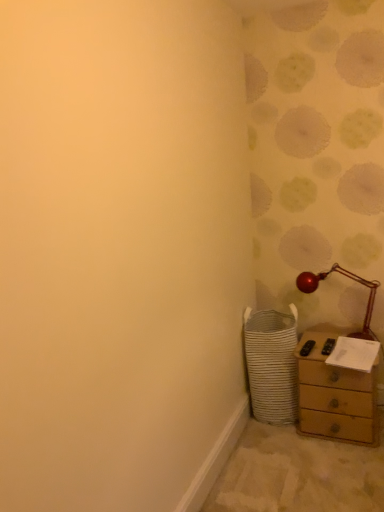
Question: From a real-world perspective, is white woven laundry basket at lower right located higher than wooden chest of drawers at lower right?

Choices:
 (A) yes
 (B) no

Answer: (A)

Question: Is white woven laundry basket at lower right closer to the viewer compared to wooden chest of drawers at lower right?

Choices:
 (A) no
 (B) yes

Answer: (A)

Question: Can we say white woven laundry basket at lower right lies outside wooden chest of drawers at lower right?

Choices:
 (A) no
 (B) yes

Answer: (B)

Question: Is wooden chest of drawers at lower right surrounded by white woven laundry basket at lower right?

Choices:
 (A) no
 (B) yes

Answer: (A)

Question: Considering the relative sizes of white woven laundry basket at lower right and wooden chest of drawers at lower right in the image provided, is white woven laundry basket at lower right wider than wooden chest of drawers at lower right?

Choices:
 (A) no
 (B) yes

Answer: (B)

Question: Does point (299, 342) appear closer or farther from the camera than point (281, 420)?

Choices:
 (A) farther
 (B) closer

Answer: (B)

Question: Would you say wooden chest of drawers at lower right is inside or outside white woven laundry basket at lower right?

Choices:
 (A) inside
 (B) outside

Answer: (B)

Question: Is wooden chest of drawers at lower right in front of or behind white woven laundry basket at lower right in the image?

Choices:
 (A) front
 (B) behind

Answer: (A)

Question: Is wooden chest of drawers at lower right wider or thinner than white woven laundry basket at lower right?

Choices:
 (A) thin
 (B) wide

Answer: (A)

Question: From the image's perspective, is white woven laundry basket at lower right positioned above or below wooden chest of drawers at lower right?

Choices:
 (A) below
 (B) above

Answer: (B)

Question: In terms of size, does white woven laundry basket at lower right appear bigger or smaller than wooden chest of drawers at lower right?

Choices:
 (A) big
 (B) small

Answer: (A)

Question: Would you say white woven laundry basket at lower right is to the left or to the right of wooden chest of drawers at lower right in the picture?

Choices:
 (A) left
 (B) right

Answer: (A)

Question: Is white woven laundry basket at lower right taller or shorter than wooden chest of drawers at lower right?

Choices:
 (A) short
 (B) tall

Answer: (B)

Question: Based on their sizes in the image, would you say metallic red table lamp at right is bigger or smaller than white woven laundry basket at lower right?

Choices:
 (A) big
 (B) small

Answer: (B)

Question: Visually, is metallic red table lamp at right positioned to the left or to the right of white woven laundry basket at lower right?

Choices:
 (A) right
 (B) left

Answer: (A)